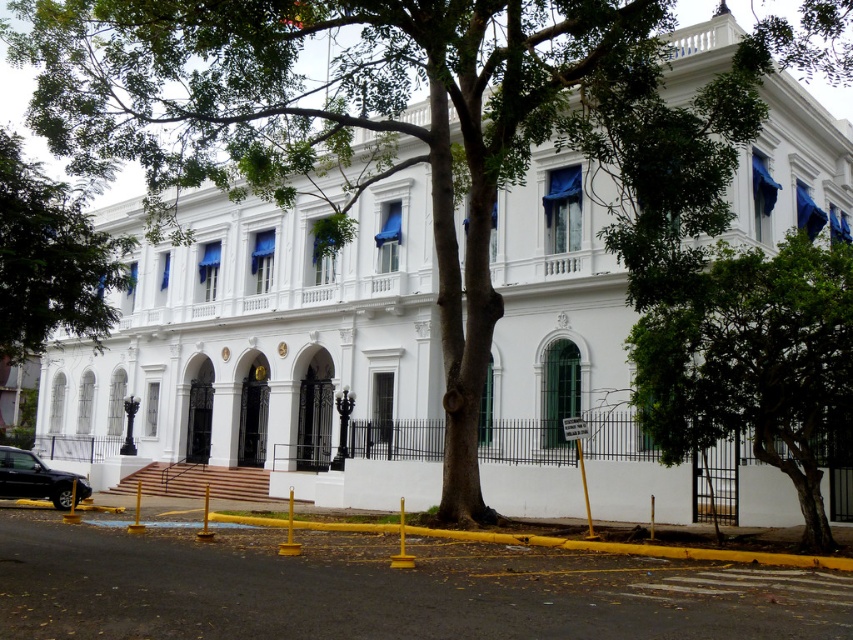
You are planning to install a pathway between the green leafy tree at center and the green leafy tree at left. Given that the pathway requires a minimum of 50 feet of space between the two trees to be feasible, can the pathway be constructed?

The distance between the green leafy tree at center and the green leafy tree at left is 71.06 feet, which exceeds the required 50 feet. Therefore, the pathway can be constructed between them.

You are a photographer planning to take a photo of the colonial building. You have a camera with a standard lens that can capture objects up to 5 meters tall. The green leafy tree at left and the shiny black sedan at lower left are in your shot. Will the tree block the view of the sedan?

The green leafy tree at left is taller than the shiny black sedan at lower left. Since the tree is taller, it might block the sedan depending on their positions. However, the question specifies capturing objects up to 5 meters tall. Without knowing their exact heights, we can infer the tree is taller but not necessarily blocking the sedan if both are within the 5m limit. The answer is inconclusive based on given info.

Looking at this image, you are standing in front of the grand colonial building and want to take a photo of the entrance. There are two green leafy trees in your view. Which tree, the green leafy tree at center or the green leafy tree at left, would cast a larger shadow on the entrance steps?

The green leafy tree at center is much taller than the green leafy tree at left, so it would cast a larger shadow on the entrance steps.